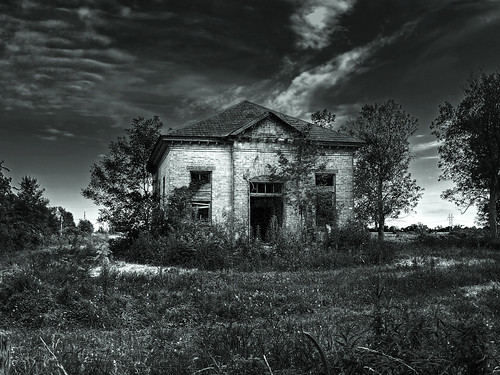
Identify the location of small square window to left. This screenshot has height=375, width=500. (195, 178), (207, 177).